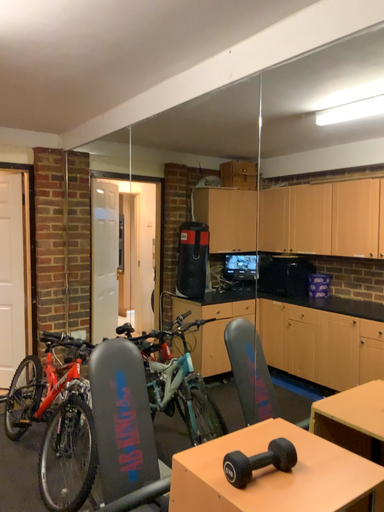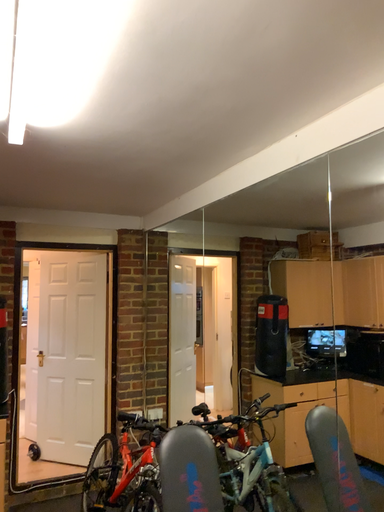
Question: How did the camera likely rotate when shooting the video?

Choices:
 (A) rotated upward
 (B) rotated downward

Answer: (A)